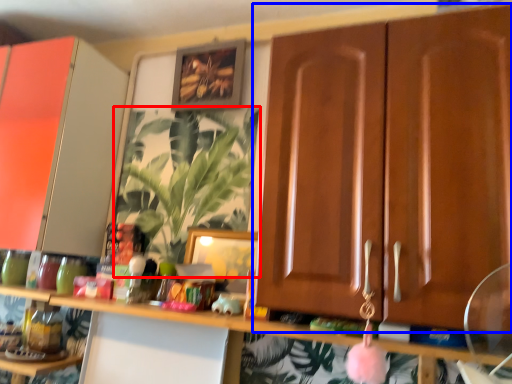
Question: Which point is closer to the camera, houseplant (highlighted by a red box) or cabinetry (highlighted by a blue box)?

Choices:
 (A) houseplant
 (B) cabinetry

Answer: (B)